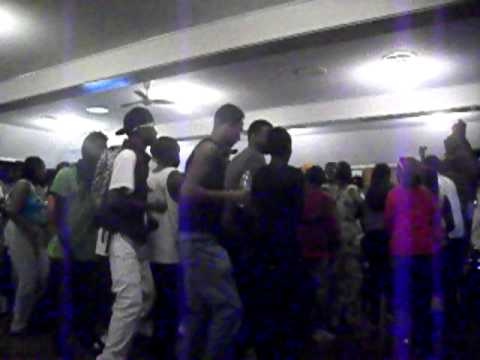
Find the location of `light`. light is located at coordinates (392, 74).